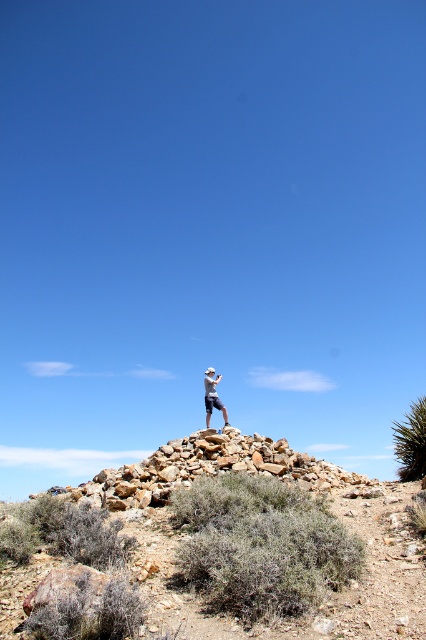
Does rockyroughrocky at center appear on the left side of light blue denim shorts at center?

Indeed, rockyroughrocky at center is positioned on the left side of light blue denim shorts at center.

Between rockyroughrocky at center and light blue denim shorts at center, which one has less height?

light blue denim shorts at center

Locate an element on the screen. rockyroughrocky at center is located at coordinates (209, 468).

Find the location of a particular element. The width and height of the screenshot is (426, 640). rockyroughrocky at center is located at coordinates (x=209, y=468).